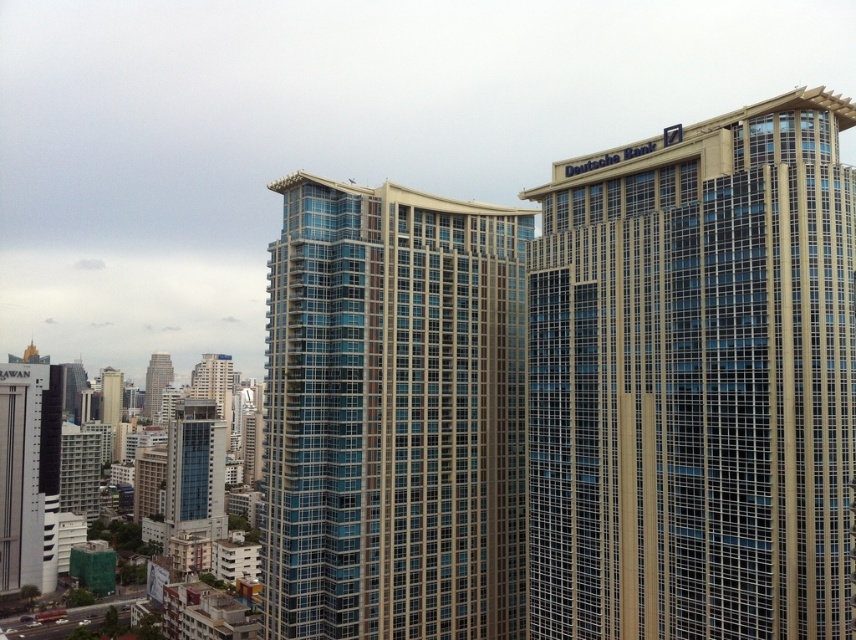
Question: Is glassy blue building at center to the left of white glossy building at lower left from the viewer's perspective?

Choices:
 (A) no
 (B) yes

Answer: (A)

Question: Does gold glass building at upper right have a greater width compared to matte glass building at left?

Choices:
 (A) yes
 (B) no

Answer: (B)

Question: Which object is the closest to the gold glass building at upper right?

Choices:
 (A) glassy blue skyscraper at center-left
 (B) blue glass building at center
 (C) glassy blue building at center

Answer: (C)

Question: Among these points, which one is farthest from the camera?

Choices:
 (A) (198, 408)
 (B) (54, 563)
 (C) (607, 570)

Answer: (A)

Question: Which point is farther from the camera taking this photo?

Choices:
 (A) (183, 440)
 (B) (158, 376)
 (C) (693, 378)

Answer: (B)

Question: Observing the image, what is the correct spatial positioning of glassy blue building at center in reference to white glossy building at lower left?

Choices:
 (A) right
 (B) left

Answer: (A)